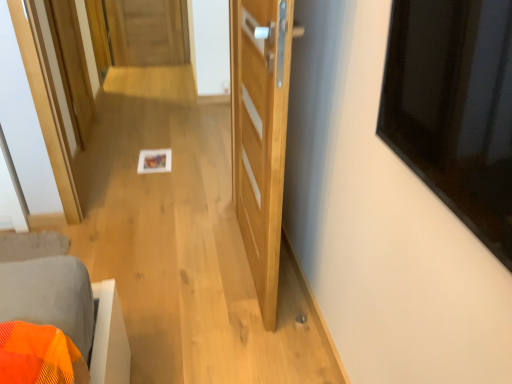
Identify the location of natural wood door at center. Image resolution: width=512 pixels, height=384 pixels. (260, 134).

What do you see at coordinates (260, 134) in the screenshot? The height and width of the screenshot is (384, 512). I see `natural wood door at center` at bounding box center [260, 134].

Locate an element on the screen. natural wood door at center is located at coordinates (260, 134).